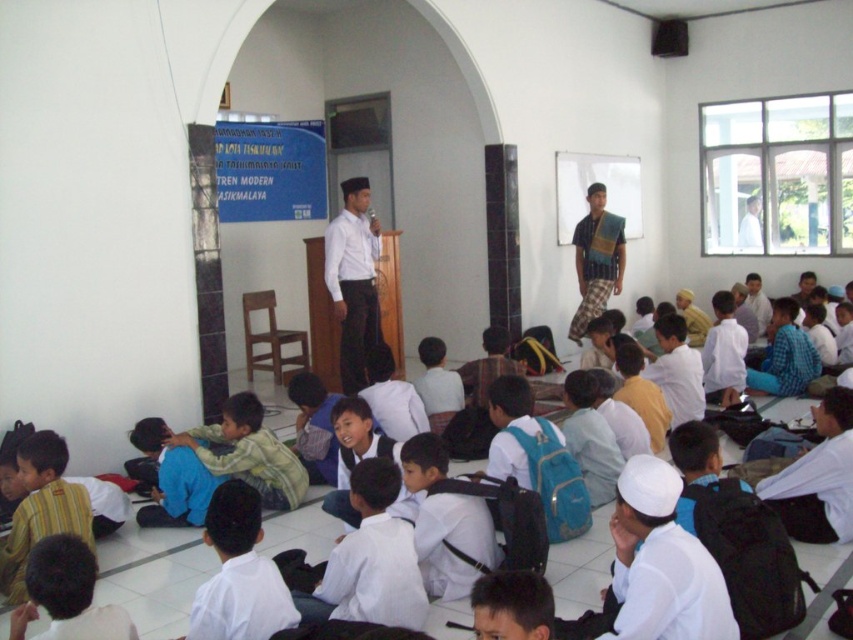
Question: Does white matte shirt at center come behind blue plaid shirt at center?

Choices:
 (A) yes
 (B) no

Answer: (B)

Question: From the image, what is the correct spatial relationship of white matte backpack at lower center in relation to striped cotton shirt at lower left?

Choices:
 (A) right
 (B) left

Answer: (A)

Question: Which object is farther from the camera taking this photo?

Choices:
 (A) white matte shirt at center
 (B) blue plaid shirt at center
 (C) striped cotton shirt at lower left
 (D) white uniform shirt at lower right

Answer: (B)

Question: Which object appears closest to the camera in this image?

Choices:
 (A) white uniform shirt at lower right
 (B) blue plaid shirt at center
 (C) white matte backpack at lower center
 (D) striped cotton shirt at lower left

Answer: (C)

Question: Which is farther from the blue plaid shirt at center?

Choices:
 (A) white matte shirt at center
 (B) white matte backpack at lower center
 (C) striped cotton shirt at lower left
 (D) white uniform shirt at lower right

Answer: (C)

Question: In this image, where is white uniform shirt at lower right located relative to striped cotton shirt at lower left?

Choices:
 (A) above
 (B) below

Answer: (A)